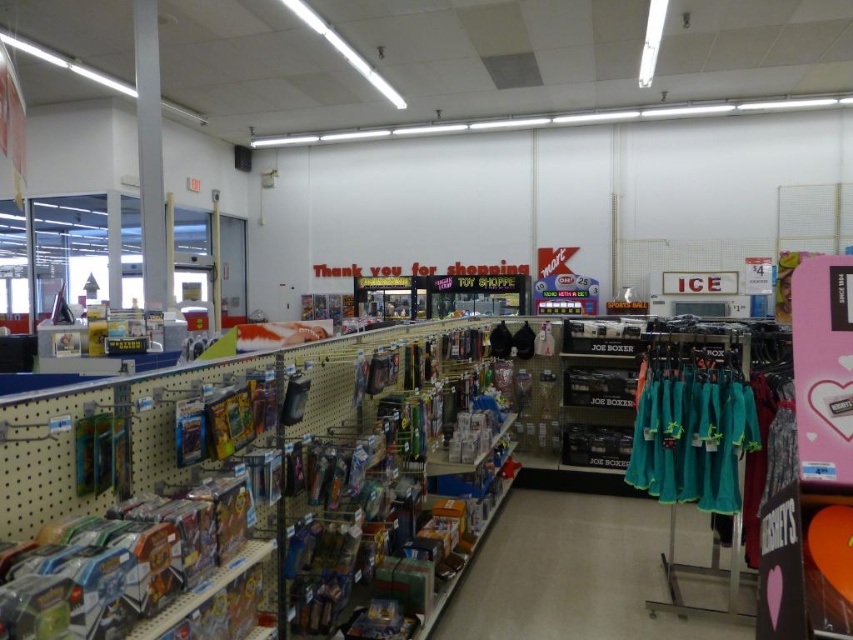
Question: Does teal fabric clothing at center appear over metallic pole at center?

Choices:
 (A) no
 (B) yes

Answer: (A)

Question: Which point appears farthest from the camera in this image?

Choices:
 (A) click(630, 520)
 (B) click(141, 160)

Answer: (B)

Question: In this image, where is teal fabric clothing at center located relative to metallic pole at center?

Choices:
 (A) above
 (B) below

Answer: (B)

Question: Can you confirm if teal fabric clothing at center is smaller than metallic pole at center?

Choices:
 (A) no
 (B) yes

Answer: (B)

Question: Among these objects, which one is nearest to the camera?

Choices:
 (A) teal fabric clothing at center
 (B) metallic pole at center

Answer: (A)

Question: Among these points, which one is farthest from the camera?

Choices:
 (A) (685, 506)
 (B) (149, 68)

Answer: (B)